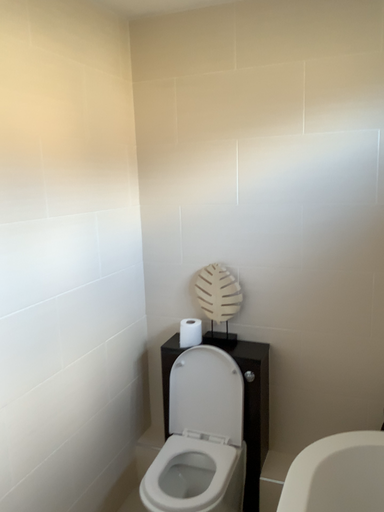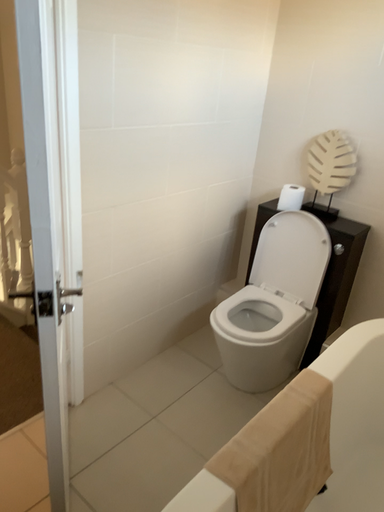
Question: Which way did the camera rotate in the video?

Choices:
 (A) rotated left
 (B) rotated right

Answer: (A)